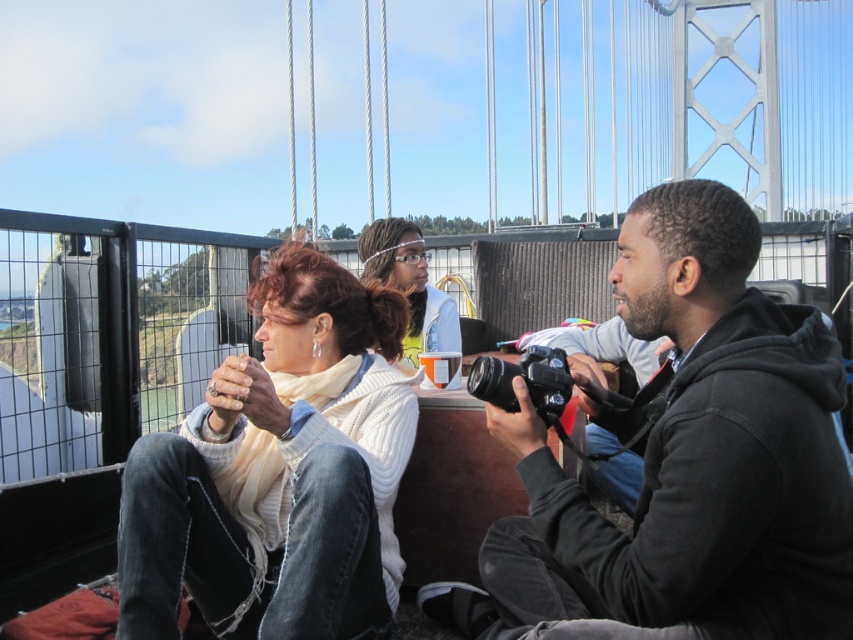
Question: Estimate the real-world distances between objects in this image. Which object is farther from the white matte hairband at center?

Choices:
 (A) black matte camera at center
 (B) white knit sweater at center

Answer: (A)

Question: Can you confirm if black matte camera at center is positioned to the left of white knit sweater at center?

Choices:
 (A) yes
 (B) no

Answer: (B)

Question: Does white knit sweater at center appear over white matte hairband at center?

Choices:
 (A) no
 (B) yes

Answer: (A)

Question: Among these points, which one is nearest to the camera?

Choices:
 (A) (838, 456)
 (B) (202, 598)

Answer: (A)

Question: Estimate the real-world distances between objects in this image. Which object is farther from the black matte camera at center?

Choices:
 (A) white matte hairband at center
 (B) white knit sweater at center

Answer: (A)

Question: Does black matte camera at center appear under white matte hairband at center?

Choices:
 (A) yes
 (B) no

Answer: (A)